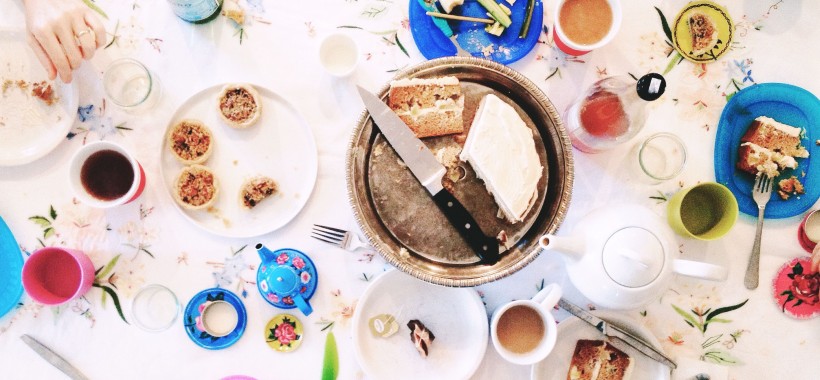
Image resolution: width=820 pixels, height=380 pixels. Identify the location of fork. (762, 206).